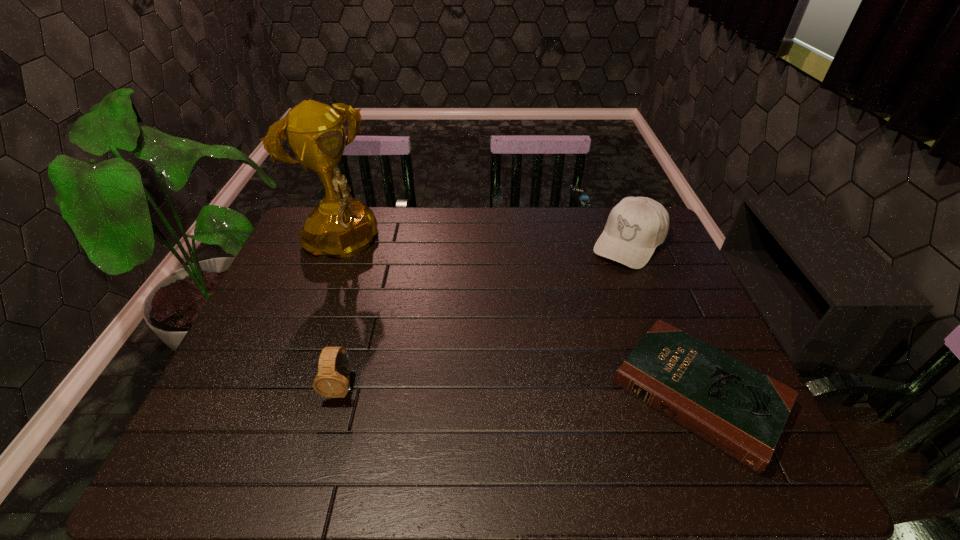
Identify the location of watch. The image size is (960, 540). (333, 378).

Find the location of a particular element. The width and height of the screenshot is (960, 540). the shortest object is located at coordinates (737, 409).

Image resolution: width=960 pixels, height=540 pixels. What are the coordinates of `baseball cap` in the screenshot? It's located at (636, 225).

Where is `the tallest object`? This screenshot has height=540, width=960. the tallest object is located at coordinates (341, 226).

Identify the location of vacant space located 0.270m on the back of the Bible. The width and height of the screenshot is (960, 540). (644, 265).

Find the location of `vacant space situated 0.150m on the front-facing side of the baseball cap`. vacant space situated 0.150m on the front-facing side of the baseball cap is located at coordinates (593, 293).

Locate an element on the screen. blank space located on the front-facing side of the baseball cap is located at coordinates (554, 343).

Locate an element on the screen. The height and width of the screenshot is (540, 960). free spot located on the front-facing side of the baseball cap is located at coordinates (590, 296).

At what (x,y) coordinates should I click in order to perform the action: click on free location located 0.380m on the front side of the award. Please return your answer as a coordinate pair (x, y). The image size is (960, 540). Looking at the image, I should click on (435, 339).

You are a GUI agent. You are given a task and a screenshot of the screen. Output one action in this format:
    pyautogui.click(x=<x>, y=<y>)
    Task: Click on the vacant space located 0.190m on the front side of the award
    The width and height of the screenshot is (960, 540).
    Given the screenshot: What is the action you would take?
    pyautogui.click(x=394, y=301)